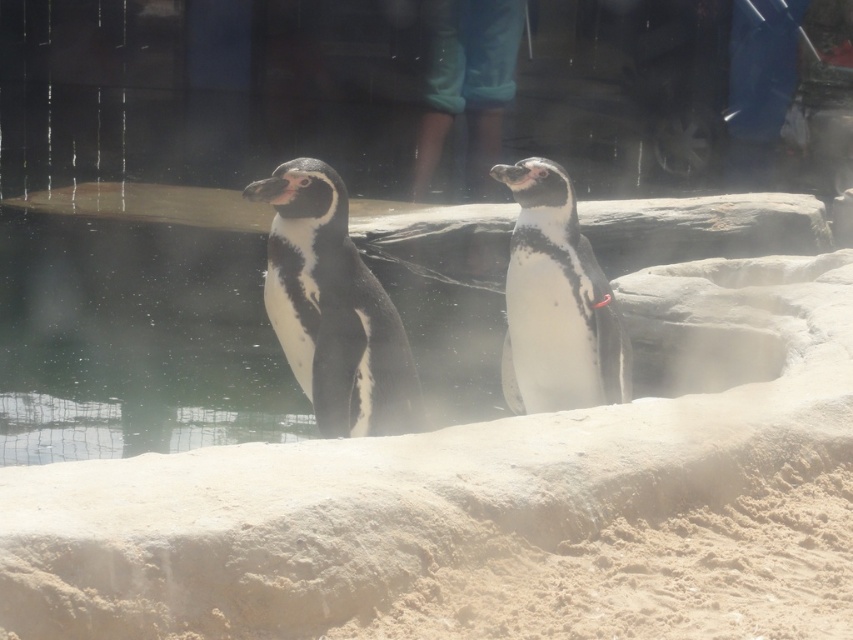
Does white matte penguin at center have a lesser width compared to smooth fabric pants at upper center?

Yes.

Who is positioned more to the right, white matte penguin at center or smooth fabric pants at upper center?

white matte penguin at center

Looking at this image, measure the distance between white matte penguin at center and camera.

white matte penguin at center and camera are 5.37 meters apart from each other.

In order to click on white matte penguin at center in this screenshot , I will do `click(556, 301)`.

Does black matte penguin at center have a greater width compared to smooth fabric pants at upper center?

No, black matte penguin at center is not wider than smooth fabric pants at upper center.

Does black matte penguin at center have a lesser width compared to smooth fabric pants at upper center?

Yes, black matte penguin at center is thinner than smooth fabric pants at upper center.

Identify the location of black matte penguin at center. This screenshot has height=640, width=853. (334, 308).

Who is more distant from viewer, (270, 230) or (585, 298)?

The point (585, 298) is behind.

Which is above, black matte penguin at center or white matte penguin at center?

Positioned higher is white matte penguin at center.

Find the location of `black matte penguin at center`. black matte penguin at center is located at coordinates (334, 308).